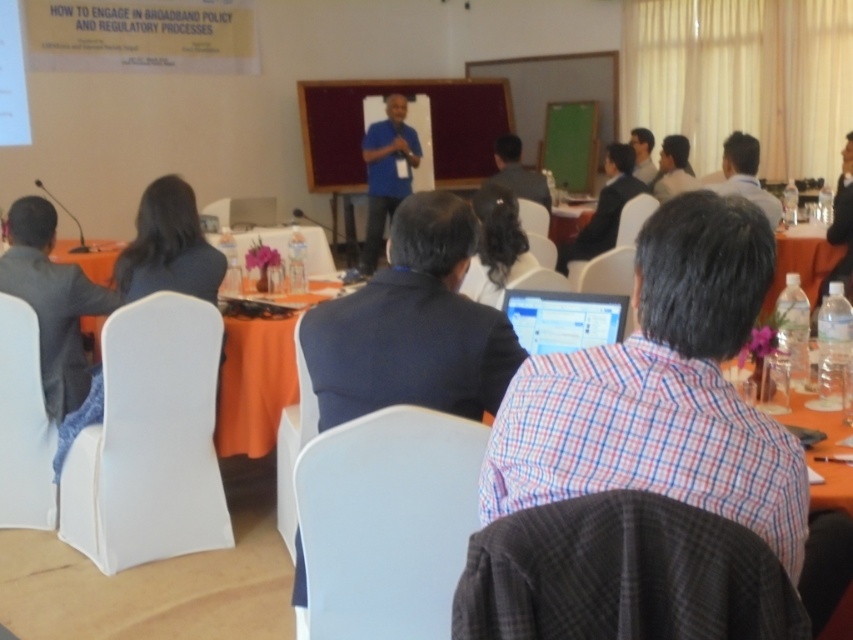
Question: Is red plaid shirt at center to the right of dark gray suit at left from the viewer's perspective?

Choices:
 (A) yes
 (B) no

Answer: (A)

Question: Which object appears closest to the camera in this image?

Choices:
 (A) dark blue shirt at upper center
 (B) light blue shirt at upper right

Answer: (B)

Question: Which point is closer to the camera?

Choices:
 (A) dark blue shirt at upper center
 (B) dark blue suit at center

Answer: (B)

Question: Does matte black shirt at center appear under matte black shirt at upper center?

Choices:
 (A) no
 (B) yes

Answer: (B)

Question: Among these objects, which one is farthest from the camera?

Choices:
 (A) matte black laptop at upper center
 (B) clear plastic bottles at right

Answer: (A)

Question: From the image, what is the correct spatial relationship of red plaid shirt at center in relation to dark blue fabric at left?

Choices:
 (A) below
 (B) above

Answer: (A)